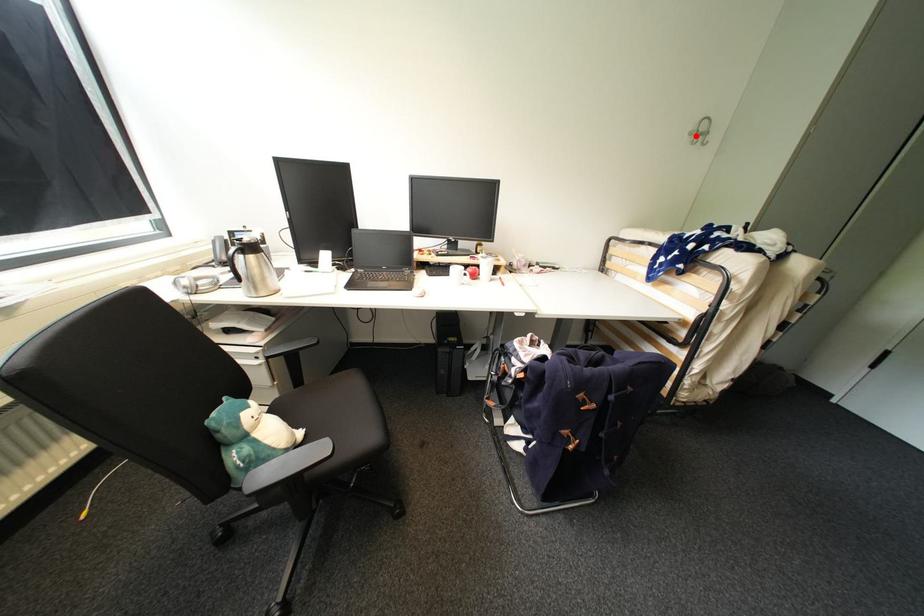
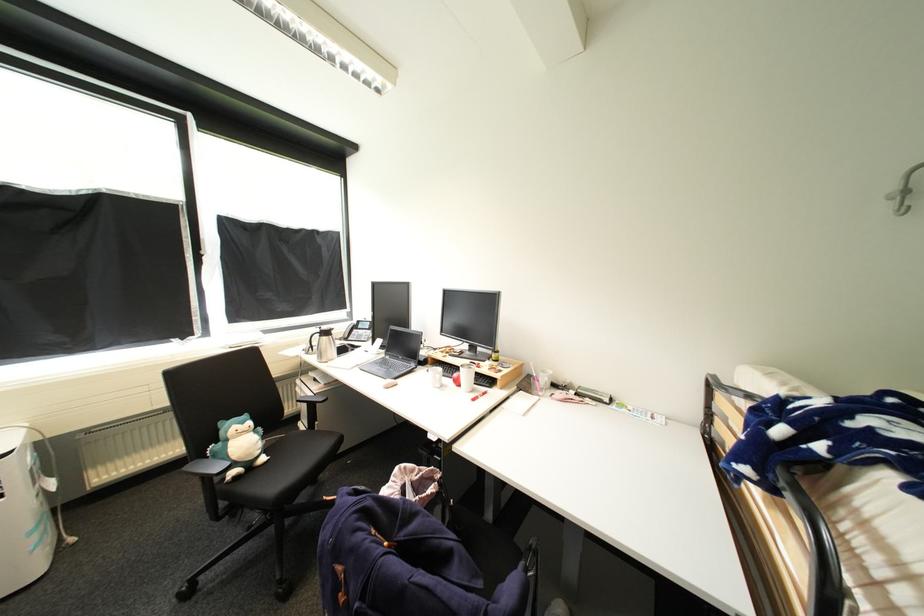
In the second image, find the point that corresponds to the highlighted location in the first image.

(900, 199)